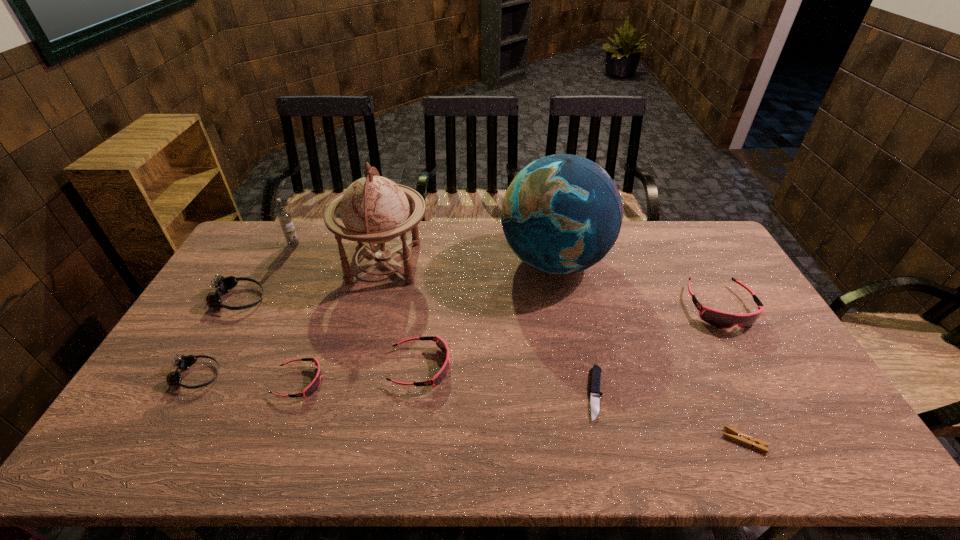
In the image, there is a desktop. In order to click on vacant space at the far left corner in this screenshot , I will do (282, 234).

The width and height of the screenshot is (960, 540). In the image, there is a desktop. Identify the location of free space at the far right corner. (717, 246).

Find the location of a particular element. The image size is (960, 540). vacant point located between the steak knife and the smaller bronze goggles is located at coordinates (396, 385).

What are the coordinates of `unoccupied area between the clothespin and the right globe` in the screenshot? It's located at (649, 351).

This screenshot has width=960, height=540. What are the coordinates of `vacant area that lies between the vodka and the steak knife` in the screenshot? It's located at (444, 319).

What are the coordinates of `unoccupied position between the farther bronze goggles and the steak knife` in the screenshot? It's located at 418,347.

Identify the location of vacant space that is in between the eighth shortest object and the steak knife. (444, 319).

Locate an element on the screen. This screenshot has width=960, height=540. empty space that is in between the vodka and the third goggles from right to left is located at coordinates (297, 313).

Find the location of `free space between the steak knife and the vodka`. free space between the steak knife and the vodka is located at coordinates (444, 319).

Identify the location of free area in between the vodka and the steak knife. The image size is (960, 540). (444, 319).